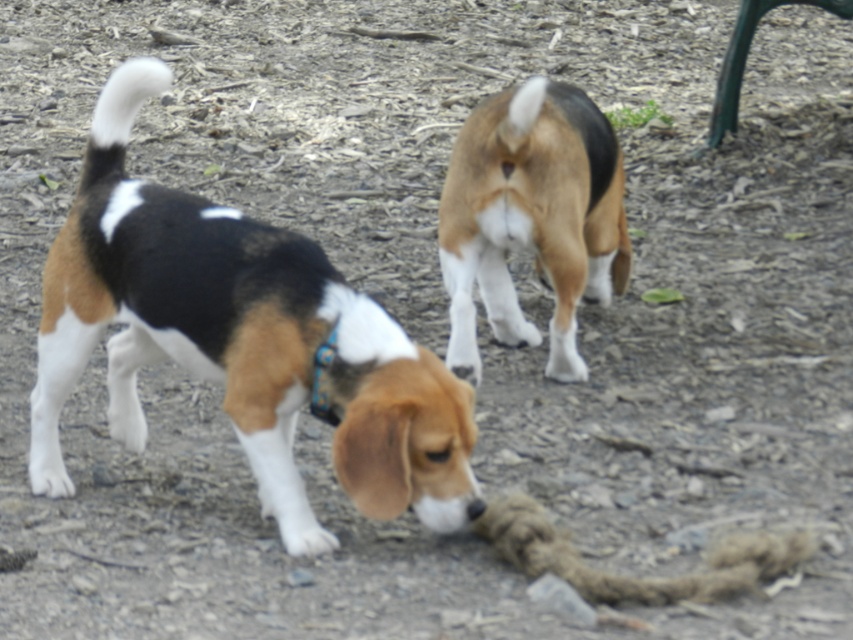
You are a photographer trying to capture a photo of the brown and white fur at center and the blue fabric neckband at lower center. Which object is positioned higher in the image?

The brown and white fur at center is located above the blue fabric neckband at lower center, so it is positioned higher in the image.

You are standing at the point with coordinates point (451, 198) and want to throw a ball to the point (123, 404). Will the ball land in front of or behind the dog that is walking away?

The ball will land in front of the dog that is walking away because point (123, 404) is in front of point (451, 198).